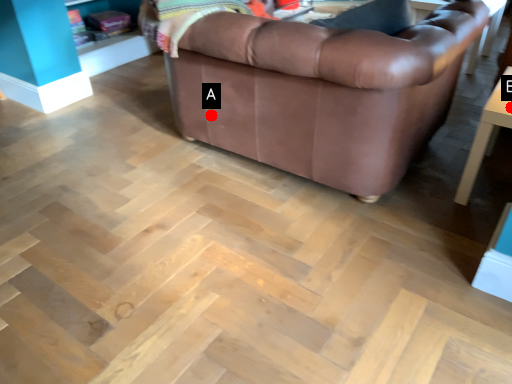
Question: Two points are circled on the image, labeled by A and B beside each circle. Which of the following is the farthest from the observer?

Choices:
 (A) A is further
 (B) B is further

Answer: (A)